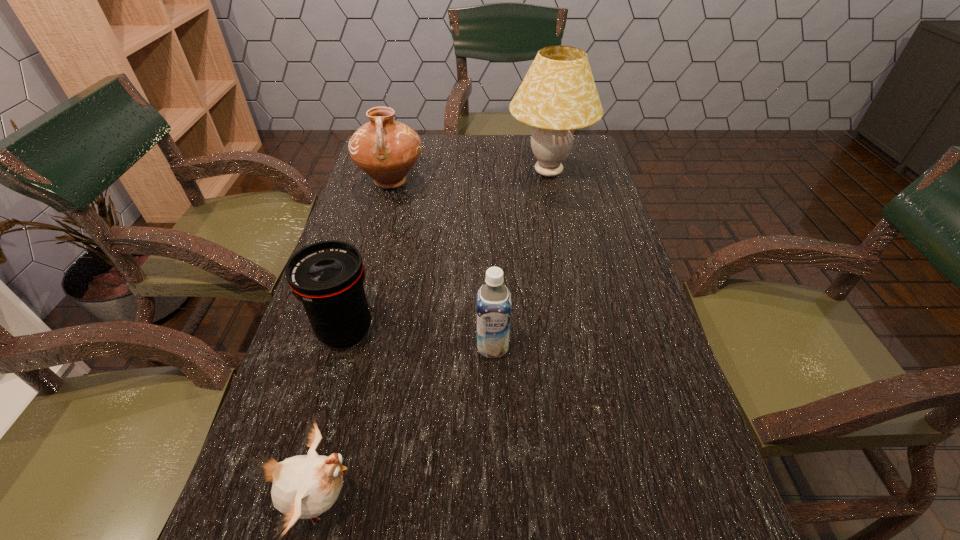
I want to click on free area in between the telephoto lens and the pottery, so click(x=368, y=256).

Where is `free space between the pottery and the telephoto lens`? The image size is (960, 540). free space between the pottery and the telephoto lens is located at coordinates (368, 256).

You are a GUI agent. You are given a task and a screenshot of the screen. Output one action in this format:
    pyautogui.click(x=<x>, y=<y>)
    Task: Click on the vacant area that lies between the pottery and the lampshade
    This screenshot has width=960, height=540.
    Given the screenshot: What is the action you would take?
    pyautogui.click(x=469, y=177)

Where is `empty location between the pottery and the soya milk`? empty location between the pottery and the soya milk is located at coordinates (442, 264).

Where is `free space between the pottery and the tallest object`? Image resolution: width=960 pixels, height=540 pixels. free space between the pottery and the tallest object is located at coordinates (469, 177).

Locate an element on the screen. The image size is (960, 540). object that ranks as the closest to the pottery is located at coordinates (558, 94).

Choose which object is the nearest neighbor to the nearest object. Please provide its 2D coordinates. Your answer should be formatted as a tuple, i.e. [(x, y)], where the tuple contains the x and y coordinates of a point satisfying the conditions above.

[(327, 277)]